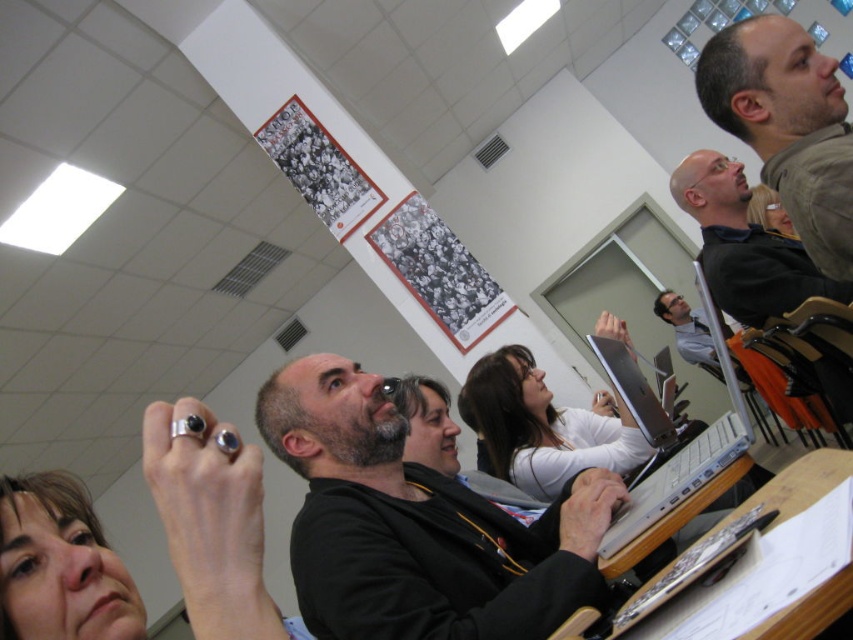
Does silver metallic ring at upper left have a greater width compared to gray fabric shirt at upper right?

Correct, the width of silver metallic ring at upper left exceeds that of gray fabric shirt at upper right.

Is point (170, 424) closer to camera compared to point (828, 128)?

Yes, it is.

Between point (103, 576) and point (833, 67), which one is positioned behind?

The point (833, 67) is behind.

Where is `silver metallic ring at upper left`? The image size is (853, 640). silver metallic ring at upper left is located at coordinates (210, 524).

Is gray fabric shirt at upper right to the right of white matte shirt at center from the viewer's perspective?

Correct, you'll find gray fabric shirt at upper right to the right of white matte shirt at center.

Which is in front, point (711, 113) or point (552, 490)?

Point (711, 113)

Find the location of a particular element. The image size is (853, 640). gray fabric shirt at upper right is located at coordinates (787, 125).

Measure the distance between point (321,605) and camera.

38.66 inches

Who is more forward, (503, 554) or (670, 308)?

Point (503, 554) is more forward.

Between point (601, 588) and point (688, 320), which one is positioned behind?

Positioned behind is point (688, 320).

I want to click on black matte shirt at center, so click(416, 524).